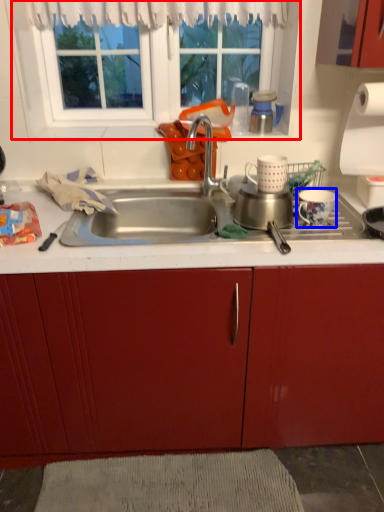
Question: Which of the following is the farthest to the observer, window (highlighted by a red box) or coffee cup (highlighted by a blue box)?

Choices:
 (A) window
 (B) coffee cup

Answer: (A)